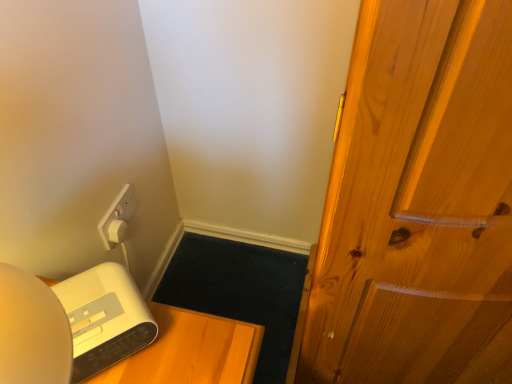
Question: Is white matte speaker at lower left at the right side of white plastic alarm clock at lower left?

Choices:
 (A) no
 (B) yes

Answer: (B)

Question: Can you confirm if white matte speaker at lower left is wider than white plastic alarm clock at lower left?

Choices:
 (A) no
 (B) yes

Answer: (B)

Question: Could you tell me if white matte speaker at lower left is facing white plastic alarm clock at lower left?

Choices:
 (A) no
 (B) yes

Answer: (A)

Question: From a real-world perspective, is white matte speaker at lower left located higher than white plastic alarm clock at lower left?

Choices:
 (A) yes
 (B) no

Answer: (B)

Question: Are white matte speaker at lower left and white plastic alarm clock at lower left located far from each other?

Choices:
 (A) yes
 (B) no

Answer: (B)

Question: From the image's perspective, is white matte speaker at lower left above white plastic alarm clock at lower left?

Choices:
 (A) yes
 (B) no

Answer: (B)

Question: Considering the relative positions of white plastic alarm clock at lower left and white matte speaker at lower left in the image provided, is white plastic alarm clock at lower left to the left of white matte speaker at lower left from the viewer's perspective?

Choices:
 (A) yes
 (B) no

Answer: (A)

Question: Is white plastic alarm clock at lower left behind white matte speaker at lower left?

Choices:
 (A) no
 (B) yes

Answer: (A)

Question: Is white plastic alarm clock at lower left oriented away from white matte speaker at lower left?

Choices:
 (A) no
 (B) yes

Answer: (A)

Question: Is white matte speaker at lower left located within white plastic alarm clock at lower left?

Choices:
 (A) yes
 (B) no

Answer: (B)

Question: Can you confirm if white plastic alarm clock at lower left is wider than white matte speaker at lower left?

Choices:
 (A) yes
 (B) no

Answer: (B)

Question: Considering the relative sizes of white plastic alarm clock at lower left and white matte speaker at lower left in the image provided, is white plastic alarm clock at lower left thinner than white matte speaker at lower left?

Choices:
 (A) no
 (B) yes

Answer: (B)

Question: Does point (73, 372) appear closer or farther from the camera than point (169, 347)?

Choices:
 (A) closer
 (B) farther

Answer: (A)